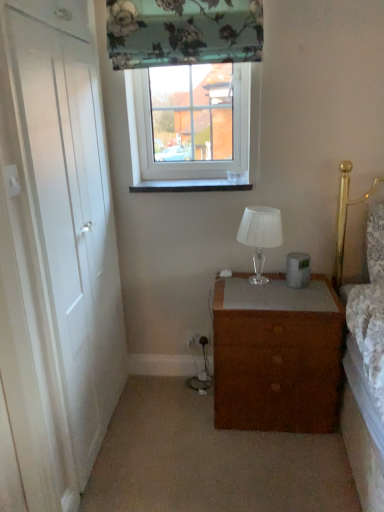
Question: Is floral fabric curtain at upper center wider or thinner than white wooden door at left?

Choices:
 (A) thin
 (B) wide

Answer: (B)

Question: Is floral fabric curtain at upper center to the left or to the right of white wooden door at left in the image?

Choices:
 (A) right
 (B) left

Answer: (A)

Question: Estimate the real-world distances between objects in this image. Which object is farther from the floral fabric curtain at upper center?

Choices:
 (A) white wooden door at left
 (B) clear glass window at upper center
 (C) brown matte chest of drawers at center
 (D) white glossy window sill at center
 (E) white glass lamp at center

Answer: (C)

Question: Considering the real-world distances, which object is farthest from the floral fabric curtain at upper center?

Choices:
 (A) white glass lamp at center
 (B) clear glass window at upper center
 (C) white wooden door at left
 (D) brown matte chest of drawers at center
 (E) white glossy window sill at center

Answer: (D)